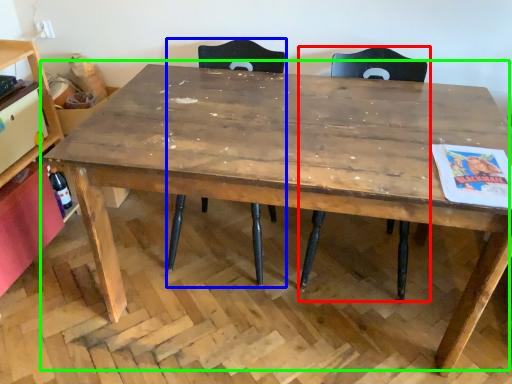
Question: Which object is the closest to the chair (highlighted by a red box)? Choose among these: chair (highlighted by a blue box) or table (highlighted by a green box).

Choices:
 (A) chair
 (B) table

Answer: (A)